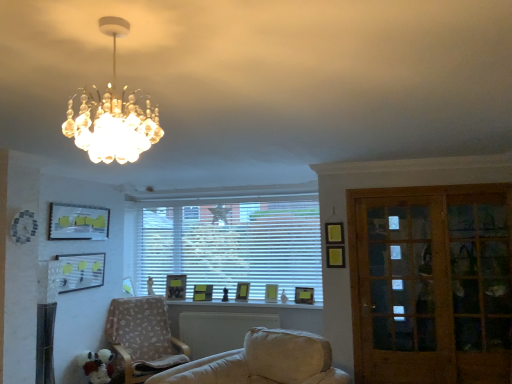
Question: From the image's perspective, is matte black picture frame at center, which is the 4th picture frame from right to left, on matte yellow picture frame at center, acting as the 6th picture frame starting from the left?

Choices:
 (A) no
 (B) yes

Answer: (A)

Question: Can you confirm if matte black picture frame at center, the fourth picture frame from the left, is shorter than matte yellow picture frame at center, which is counted as the second picture frame, starting from the right?

Choices:
 (A) no
 (B) yes

Answer: (A)

Question: From a real-world perspective, is matte black picture frame at center, the fourth picture frame from the left, positioned under matte yellow picture frame at center, acting as the 6th picture frame starting from the left, based on gravity?

Choices:
 (A) no
 (B) yes

Answer: (A)

Question: Is the depth of matte black picture frame at center, the fourth picture frame from the left, less than that of matte yellow picture frame at center, which is counted as the second picture frame, starting from the right?

Choices:
 (A) no
 (B) yes

Answer: (A)

Question: Does matte black picture frame at center, the fourth picture frame from the left, appear on the left side of matte yellow picture frame at center, acting as the 6th picture frame starting from the left?

Choices:
 (A) yes
 (B) no

Answer: (A)

Question: From a real-world perspective, is white blinds at center positioned above or below crystal chandelier at upper left?

Choices:
 (A) below
 (B) above

Answer: (A)

Question: From their relative heights in the image, would you say white blinds at center is taller or shorter than crystal chandelier at upper left?

Choices:
 (A) tall
 (B) short

Answer: (A)

Question: Choose the correct answer: Is white blinds at center inside crystal chandelier at upper left or outside it?

Choices:
 (A) outside
 (B) inside

Answer: (A)

Question: Considering the relative positions of white blinds at center and crystal chandelier at upper left in the image provided, is white blinds at center to the left or to the right of crystal chandelier at upper left?

Choices:
 (A) right
 (B) left

Answer: (A)

Question: Considering the positions of wooden glass door at right and matte black picture frame at center, which is the 4th picture frame from right to left, in the image, is wooden glass door at right wider or thinner than matte black picture frame at center, which is the 4th picture frame from right to left,?

Choices:
 (A) thin
 (B) wide

Answer: (A)

Question: Would you say wooden glass door at right is to the left or to the right of matte black picture frame at center, which is the 4th picture frame from right to left, in the picture?

Choices:
 (A) right
 (B) left

Answer: (A)

Question: Is point (400, 251) closer or farther from the camera than point (205, 289)?

Choices:
 (A) farther
 (B) closer

Answer: (B)

Question: From the image's perspective, relative to matte black picture frame at center, which is the 4th picture frame from right to left, is wooden glass door at right above or below?

Choices:
 (A) above
 (B) below

Answer: (A)

Question: Is matte yellow picture frame at window, which is the 1th picture frame in right-to-left order, spatially inside matte yellow picture frame at center, which is counted as the second picture frame, starting from the right, or outside of it?

Choices:
 (A) outside
 (B) inside

Answer: (A)

Question: From a real-world perspective, is matte yellow picture frame at window, which is the 1th picture frame in right-to-left order, above or below matte yellow picture frame at center, acting as the 6th picture frame starting from the left?

Choices:
 (A) below
 (B) above

Answer: (A)